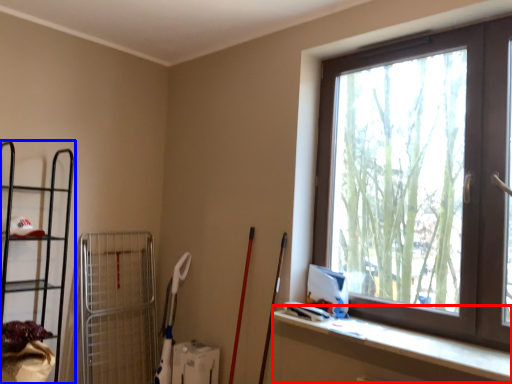
Question: Which object appears closest to the camera in this image, ledge (highlighted by a red box) or shelf (highlighted by a blue box)?

Choices:
 (A) ledge
 (B) shelf

Answer: (A)